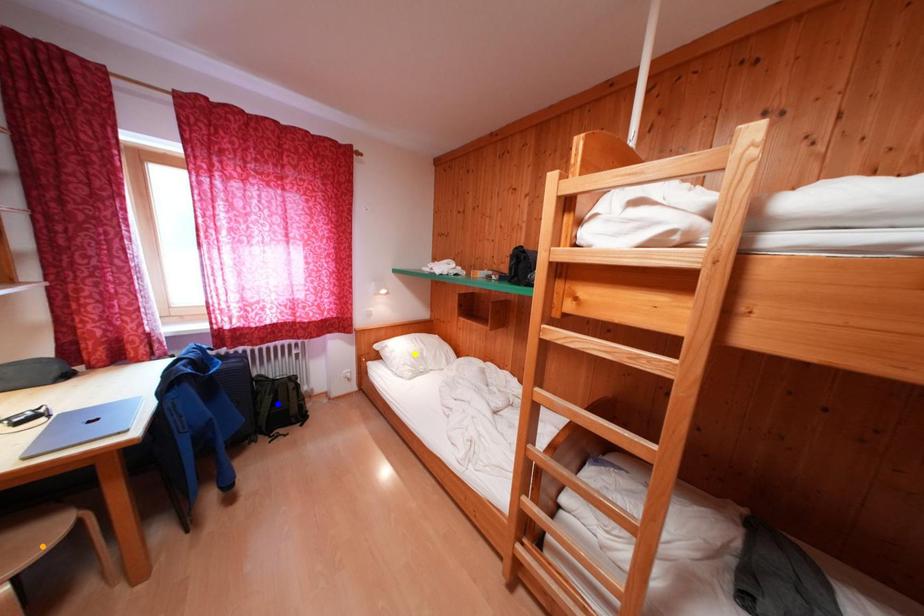
Order these from nearest to farthest:
A) blue point
B) yellow point
C) orange point

orange point → blue point → yellow point